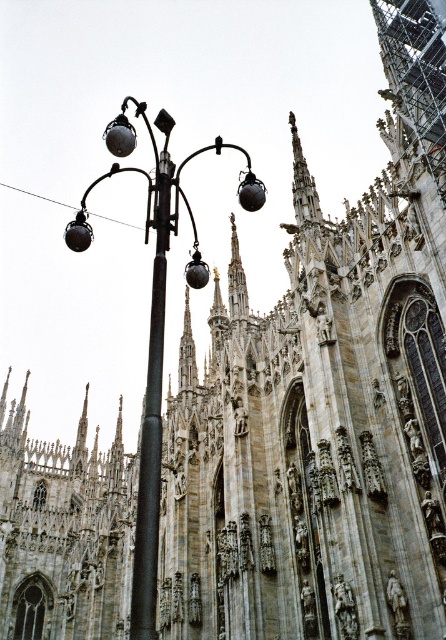
Question: Is matte black street light at left above black metal pole at center?

Choices:
 (A) no
 (B) yes

Answer: (B)

Question: Is matte black street light at left smaller than black metal pole at center?

Choices:
 (A) no
 (B) yes

Answer: (A)

Question: Does matte black street light at left come behind black metal pole at center?

Choices:
 (A) yes
 (B) no

Answer: (A)

Question: Which of the following is the farthest from the observer?

Choices:
 (A) black metal pole at center
 (B) matte black street light at left

Answer: (B)

Question: Which object is closer to the camera taking this photo?

Choices:
 (A) matte black street light at left
 (B) black metal pole at center

Answer: (B)